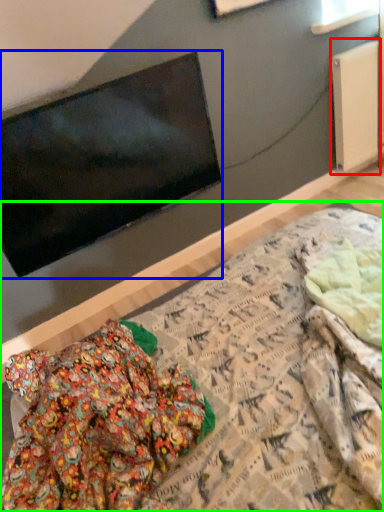
Question: Which is nearer to the radiator (highlighted by a red box)? television (highlighted by a blue box) or bed (highlighted by a green box).

Choices:
 (A) television
 (B) bed

Answer: (A)